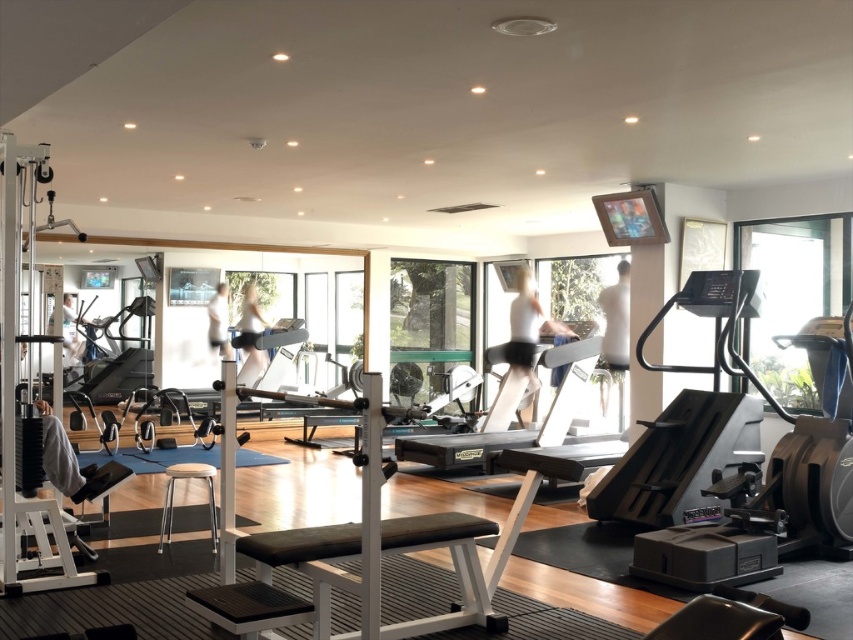
Question: Among these points, which one is nearest to the camera?

Choices:
 (A) (643, 330)
 (B) (582, 368)

Answer: (A)

Question: Can you confirm if black plastic treadmill at center is thinner than silver metallic treadmill at center?

Choices:
 (A) no
 (B) yes

Answer: (B)

Question: Which of the following is the closest to the observer?

Choices:
 (A) (419, 440)
 (B) (709, 298)

Answer: (B)

Question: Is black plastic treadmill at center smaller than silver metallic treadmill at center?

Choices:
 (A) yes
 (B) no

Answer: (A)

Question: Does black plastic treadmill at center appear on the right side of silver metallic treadmill at center?

Choices:
 (A) yes
 (B) no

Answer: (A)